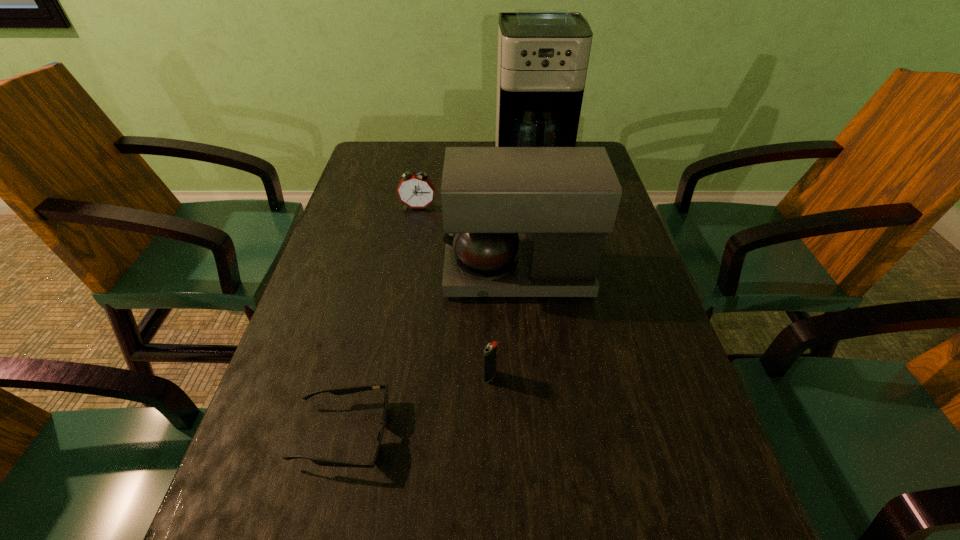
I want to click on vacant region that satisfies the following two spatial constraints: 1. on the front panel of the tallest object; 2. on the carafe side of the third nearest object, so click(550, 273).

Image resolution: width=960 pixels, height=540 pixels. Identify the location of free space that satisfies the following two spatial constraints: 1. on the front panel of the tallest object; 2. on the carafe side of the nearer coffee maker. [550, 273].